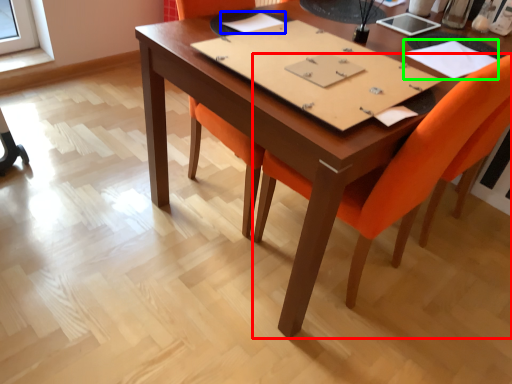
Question: Estimate the real-world distances between objects in this image. Which object is closer to chair (highlighted by a red box), notebook (highlighted by a blue box) or notebook (highlighted by a green box)?

Choices:
 (A) notebook
 (B) notebook

Answer: (B)